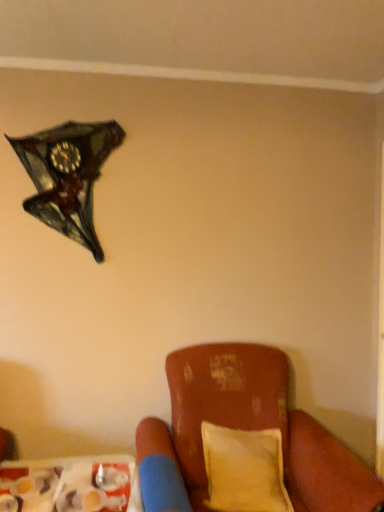
Question: Can you confirm if plastic tray at lower left is positioned to the left of leather cushion at lower right?

Choices:
 (A) yes
 (B) no

Answer: (A)

Question: Does plastic tray at lower left come behind leather cushion at lower right?

Choices:
 (A) yes
 (B) no

Answer: (A)

Question: Considering the relative sizes of plastic tray at lower left and leather cushion at lower right in the image provided, is plastic tray at lower left shorter than leather cushion at lower right?

Choices:
 (A) yes
 (B) no

Answer: (A)

Question: Is plastic tray at lower left bigger than leather cushion at lower right?

Choices:
 (A) no
 (B) yes

Answer: (A)

Question: Is plastic tray at lower left oriented towards leather cushion at lower right?

Choices:
 (A) yes
 (B) no

Answer: (B)

Question: Is yellow fabric pillow at lower right wider or thinner than leather cushion at lower right?

Choices:
 (A) thin
 (B) wide

Answer: (A)

Question: From a real-world perspective, is yellow fabric pillow at lower right above or below leather cushion at lower right?

Choices:
 (A) below
 (B) above

Answer: (A)

Question: Is point [x=253, y=460] positioned closer to the camera than point [x=241, y=375]?

Choices:
 (A) closer
 (B) farther

Answer: (A)

Question: Considering the relative positions of yellow fabric pillow at lower right and leather cushion at lower right in the image provided, is yellow fabric pillow at lower right to the left or to the right of leather cushion at lower right?

Choices:
 (A) left
 (B) right

Answer: (A)

Question: Does point (119, 138) appear closer or farther from the camera than point (266, 448)?

Choices:
 (A) closer
 (B) farther

Answer: (B)

Question: In terms of size, does shiny glass clock at upper left appear bigger or smaller than yellow fabric pillow at lower right?

Choices:
 (A) small
 (B) big

Answer: (A)

Question: Considering their positions, is shiny glass clock at upper left located in front of or behind yellow fabric pillow at lower right?

Choices:
 (A) behind
 (B) front

Answer: (A)

Question: In terms of width, does shiny glass clock at upper left look wider or thinner when compared to yellow fabric pillow at lower right?

Choices:
 (A) wide
 (B) thin

Answer: (B)

Question: Is point (173, 382) positioned closer to the camera than point (279, 466)?

Choices:
 (A) closer
 (B) farther

Answer: (B)

Question: From a real-world perspective, is leather cushion at lower right above or below yellow fabric pillow at lower right?

Choices:
 (A) above
 (B) below

Answer: (A)